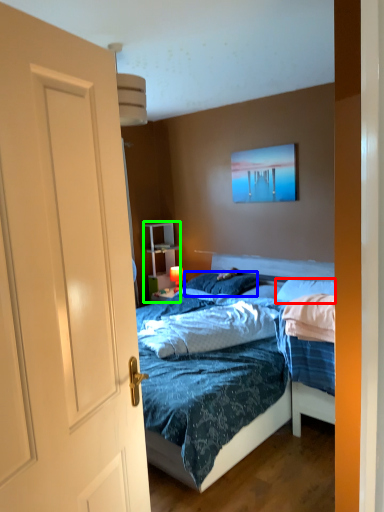
Question: Estimate the real-world distances between objects in this image. Which object is closer to pillow (highlighted by a red box), pillow (highlighted by a blue box) or armoire (highlighted by a green box)?

Choices:
 (A) pillow
 (B) armoire

Answer: (A)